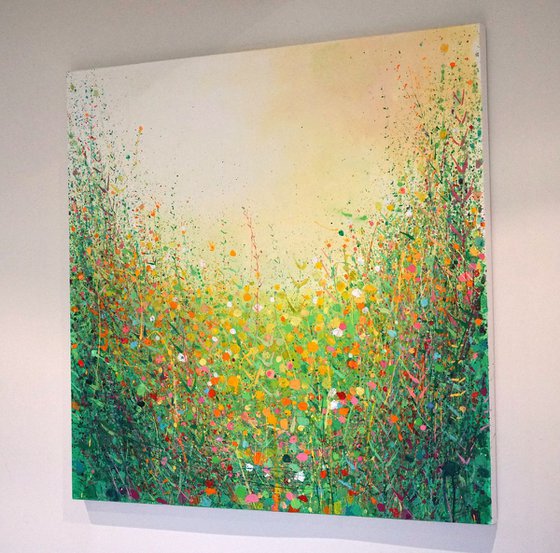
Locate an element on the screen. The width and height of the screenshot is (560, 553). wall is located at coordinates (525, 316).